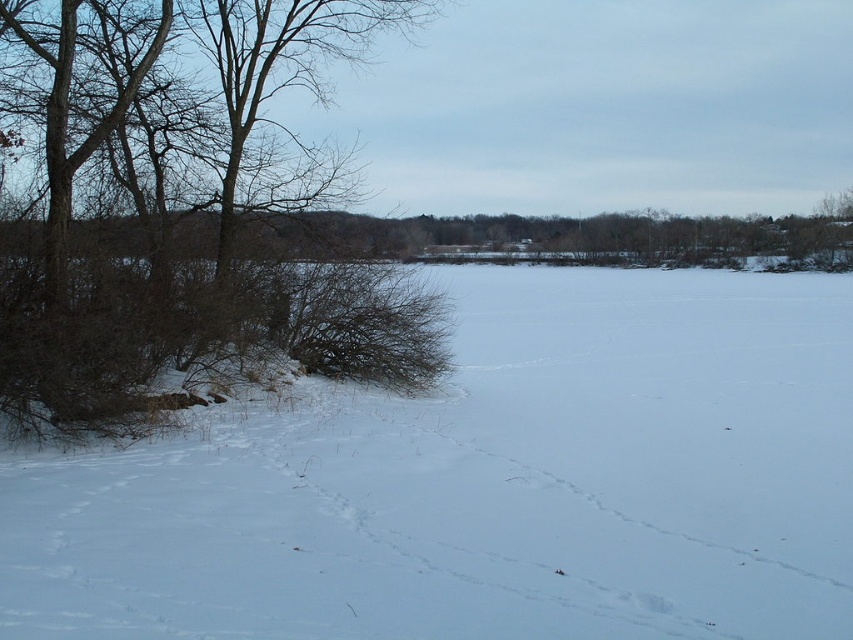
Question: Does white powdery snow at lower left appear under brown/dry wood at left?

Choices:
 (A) no
 (B) yes

Answer: (B)

Question: Which point appears farthest from the camera in this image?

Choices:
 (A) (262, 268)
 (B) (659, 490)

Answer: (A)

Question: Which point is closer to the camera?

Choices:
 (A) pos(361,394)
 (B) pos(265,118)

Answer: (A)

Question: Can you confirm if white powdery snow at lower left is positioned to the left of brown/dry wood at left?

Choices:
 (A) no
 (B) yes

Answer: (A)

Question: Does white powdery snow at lower left come behind brown/dry wood at left?

Choices:
 (A) no
 (B) yes

Answer: (A)